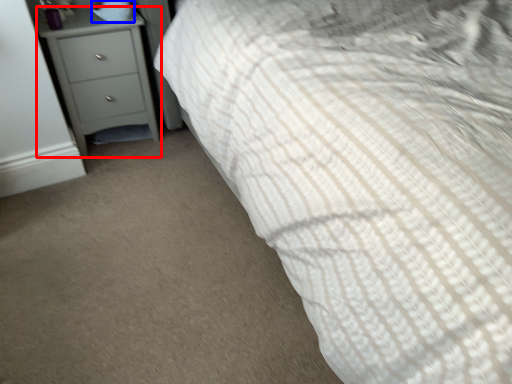
Question: Which object appears farthest to the camera in this image, chest of drawers (highlighted by a red box) or pillow (highlighted by a blue box)?

Choices:
 (A) chest of drawers
 (B) pillow

Answer: (B)